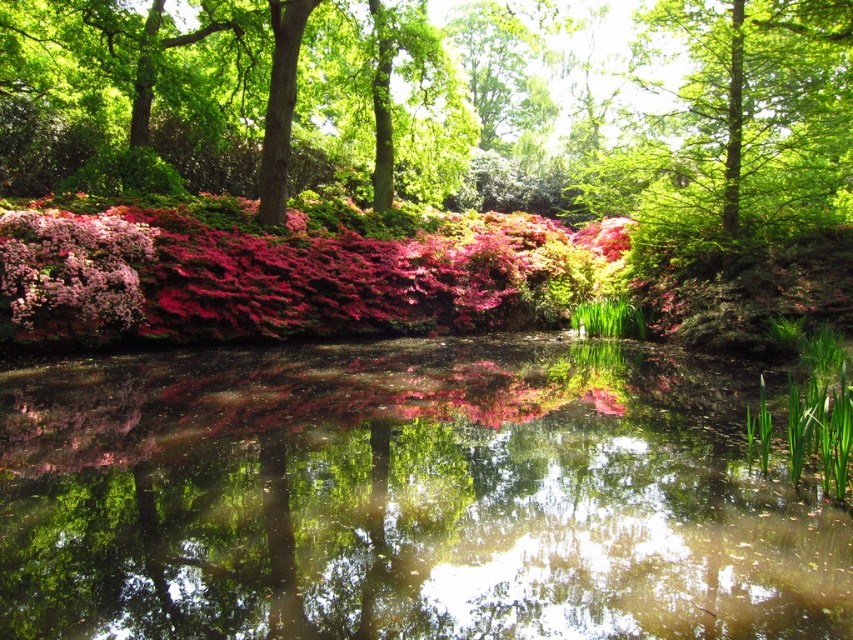
From the picture: You are standing in the garden and want to walk from the pink azaleas to the pond. Which point should you step on first, point (416, 509) or point (16, 275)?

You should step on point (416, 509) first because it is in front of point (16, 275).

You are a gardener who wants to plant a new flower between the transparent water at center and the pink matte flowers at center. Based on their positions, which object should you place the new flower closer to?

You should place the new flower closer to the pink matte flowers at center because the transparent water at center is positioned on the right side of the pink matte flowers at center, meaning the flowers are to the left of the water. Therefore, placing the new flower between them would require it to be closer to the flowers on the left side.

You are a gardener planning to place a small statue in the garden. The statue requires a base that is taller than the transparent water at center but shorter than the pink matte flowers at center. Can you determine if the statue will fit between these two objects?

The transparent water at center has a lesser height compared to the pink matte flowers at center, so the statue can be placed as long as its base height is between the two.